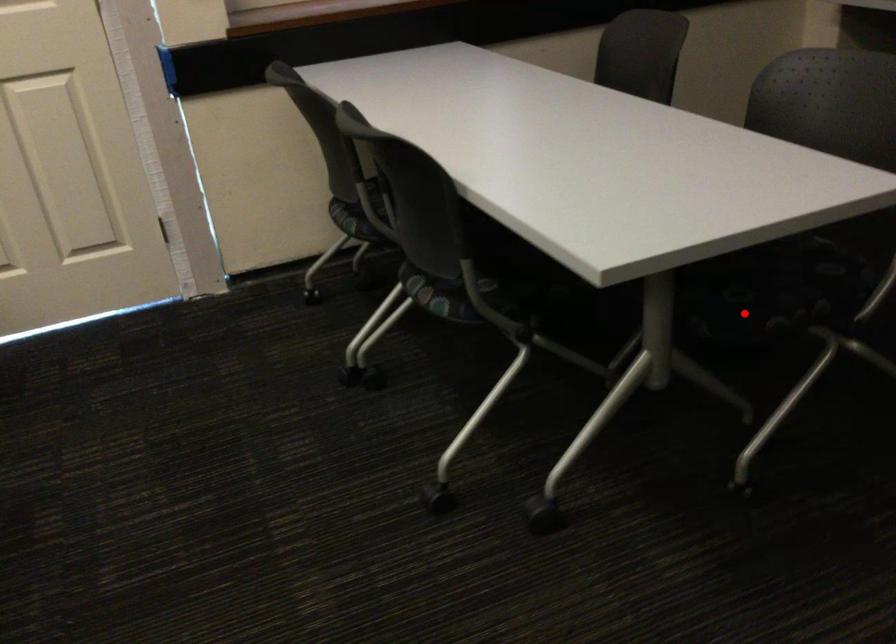
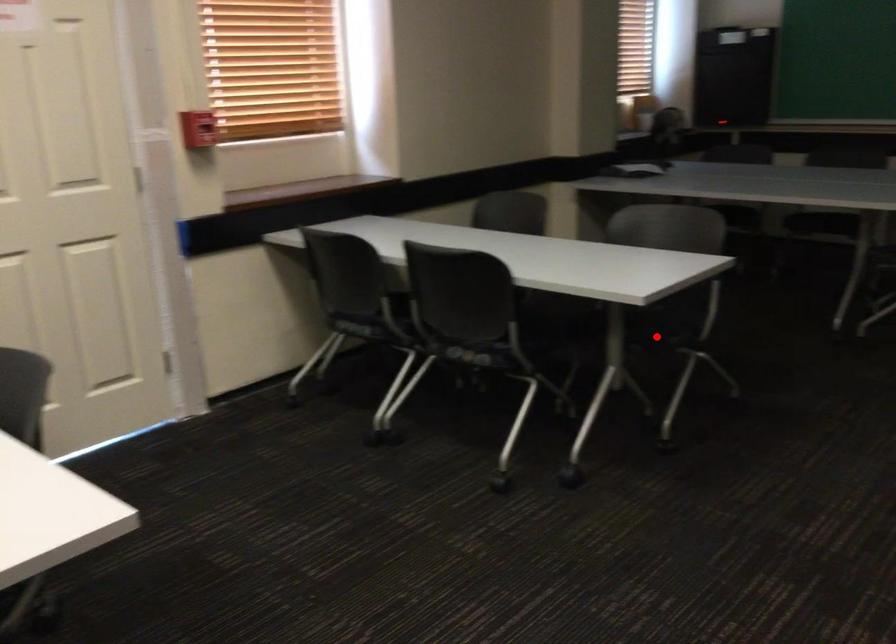
I am providing you with two images of the same scene from different viewpoints. A red point is marked on the first image and another point is marked on the second image. Is the marked point in image1 the same physical position as the marked point in image2?

Yes